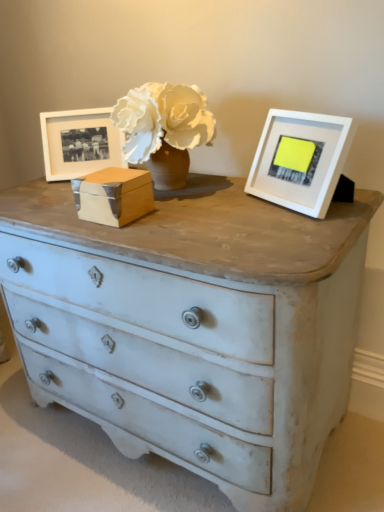
The image size is (384, 512). Identify the location of matte white picture frame at left, the 2th picture frame from the front. (80, 143).

Does matte white picture frame at left, the 2th picture frame from the front, appear on the right side of white matte picture frame at upper right, the first picture frame in the front-to-back sequence?

In fact, matte white picture frame at left, the 2th picture frame from the front, is to the left of white matte picture frame at upper right, the first picture frame in the front-to-back sequence.

Is matte white picture frame at left, which is counted as the 1th picture frame, starting from the left, turned away from white matte picture frame at upper right, which is the second picture frame from back to front?

No, matte white picture frame at left, which is counted as the 1th picture frame, starting from the left,'s orientation is not away from white matte picture frame at upper right, which is the second picture frame from back to front.

Considering the relative sizes of matte white picture frame at left, the first picture frame from the back, and white matte picture frame at upper right, the second picture frame viewed from the left, in the image provided, is matte white picture frame at left, the first picture frame from the back, smaller than white matte picture frame at upper right, the second picture frame viewed from the left,?

Yes, matte white picture frame at left, the first picture frame from the back, is smaller than white matte picture frame at upper right, the second picture frame viewed from the left.

Which object is thinner, wooden box at center or matte white picture frame at left, the first picture frame from the back?

matte white picture frame at left, the first picture frame from the back, is thinner.

Can you confirm if wooden box at center is positioned to the right of matte white picture frame at left, the 2th picture frame from the front?

Indeed, wooden box at center is positioned on the right side of matte white picture frame at left, the 2th picture frame from the front.

Would you say wooden box at center is a long distance from matte white picture frame at left, the 2th picture frame from the front?

Actually, wooden box at center and matte white picture frame at left, the 2th picture frame from the front, are a little close together.

From a real-world perspective, between wooden box at center and matte white picture frame at left, the first picture frame from the back, who is vertically lower?

wooden box at center.

Is white matte picture frame at upper right, the second picture frame viewed from the left, further to camera compared to matte white picture frame at left, which is counted as the 1th picture frame, starting from the left?

No, white matte picture frame at upper right, the second picture frame viewed from the left, is closer to the camera.

From the image's perspective, which is above, white matte picture frame at upper right, the 1th picture frame from the right, or matte white picture frame at left, which is counted as the 1th picture frame, starting from the left?

matte white picture frame at left, which is counted as the 1th picture frame, starting from the left.

From a real-world perspective, is white matte picture frame at upper right, the 1th picture frame from the right, above or below matte white picture frame at left, the first picture frame from the back?

Clearly, from a real-world perspective, white matte picture frame at upper right, the 1th picture frame from the right, is below matte white picture frame at left, the first picture frame from the back.

Is wooden box at center a part of matte white picture frame at left, the 2th picture frame from the front?

That's incorrect, wooden box at center is not inside matte white picture frame at left, the 2th picture frame from the front.

Which of these two, matte white picture frame at left, the first picture frame from the back, or wooden box at center, is smaller?

wooden box at center is smaller.

Which of these two, matte white picture frame at left, the first picture frame from the back, or wooden box at center, is thinner?

Thinner between the two is matte white picture frame at left, the first picture frame from the back.

Considering the sizes of matte white picture frame at left, the first picture frame from the back, and wooden box at center in the image, is matte white picture frame at left, the first picture frame from the back, taller or shorter than wooden box at center?

Considering their sizes, matte white picture frame at left, the first picture frame from the back, has more height than wooden box at center.

Is wooden box at center positioned with its back to white matte picture frame at upper right, which is the second picture frame from back to front?

wooden box at center is not turned away from white matte picture frame at upper right, which is the second picture frame from back to front.

Considering the relative sizes of wooden box at center and white matte picture frame at upper right, which is the second picture frame from back to front, in the image provided, is wooden box at center wider than white matte picture frame at upper right, which is the second picture frame from back to front,?

Yes.

From a real-world perspective, is wooden box at center under white matte picture frame at upper right, which is the second picture frame from back to front?

Indeed, from a real-world perspective, wooden box at center is positioned beneath white matte picture frame at upper right, which is the second picture frame from back to front.

From the image's perspective, is wooden box at center above or below white matte picture frame at upper right, which is the second picture frame from back to front?

wooden box at center is situated lower than white matte picture frame at upper right, which is the second picture frame from back to front, in the image.

Looking at this image, is white matte picture frame at upper right, the 1th picture frame from the right, taller or shorter than wooden box at center?

Considering their sizes, white matte picture frame at upper right, the 1th picture frame from the right, has more height than wooden box at center.

Is wooden box at center at the back of white matte picture frame at upper right, the 1th picture frame from the right?

white matte picture frame at upper right, the 1th picture frame from the right, is not turned away from wooden box at center.

Considering the sizes of objects white matte picture frame at upper right, the 1th picture frame from the right, and wooden box at center in the image provided, who is thinner, white matte picture frame at upper right, the 1th picture frame from the right, or wooden box at center?

With smaller width is white matte picture frame at upper right, the 1th picture frame from the right.

Locate an element on the screen. This screenshot has width=384, height=512. picture frame that is below the matte white picture frame at left, marked as the 2th picture frame in a right-to-left arrangement (from the image's perspective) is located at coordinates (300, 160).

Identify the location of box located in front of the matte white picture frame at left, the first picture frame from the back. Image resolution: width=384 pixels, height=512 pixels. click(x=113, y=196).

Estimate the real-world distances between objects in this image. Which object is further from matte white picture frame at left, marked as the 2th picture frame in a right-to-left arrangement, wooden box at center or white matte picture frame at upper right, the first picture frame in the front-to-back sequence?

Based on the image, white matte picture frame at upper right, the first picture frame in the front-to-back sequence, appears to be further to matte white picture frame at left, marked as the 2th picture frame in a right-to-left arrangement.

Based on their spatial positions, is wooden box at center or matte white picture frame at left, which is counted as the 1th picture frame, starting from the left, further from white matte picture frame at upper right, the first picture frame in the front-to-back sequence?

Among the two, matte white picture frame at left, which is counted as the 1th picture frame, starting from the left, is located further to white matte picture frame at upper right, the first picture frame in the front-to-back sequence.

Estimate the real-world distances between objects in this image. Which object is closer to matte white picture frame at left, which is counted as the 1th picture frame, starting from the left, white matte picture frame at upper right, the first picture frame in the front-to-back sequence, or wooden box at center?

wooden box at center is closer to matte white picture frame at left, which is counted as the 1th picture frame, starting from the left.

From the image, which object appears to be nearer to wooden box at center, matte white picture frame at left, which is counted as the 1th picture frame, starting from the left, or white matte picture frame at upper right, which is the second picture frame from back to front?

matte white picture frame at left, which is counted as the 1th picture frame, starting from the left.

Looking at the image, which one is located closer to wooden box at center, white matte picture frame at upper right, the second picture frame viewed from the left, or matte white picture frame at left, the 2th picture frame from the front?

matte white picture frame at left, the 2th picture frame from the front.

Considering their positions, is matte white picture frame at left, the first picture frame from the back, positioned further to white matte picture frame at upper right, the 1th picture frame from the right, than wooden box at center?

The object further to white matte picture frame at upper right, the 1th picture frame from the right, is matte white picture frame at left, the first picture frame from the back.

The width and height of the screenshot is (384, 512). In order to click on box between matte white picture frame at left, the 2th picture frame from the front, and white matte picture frame at upper right, the second picture frame viewed from the left in this screenshot , I will do `click(113, 196)`.